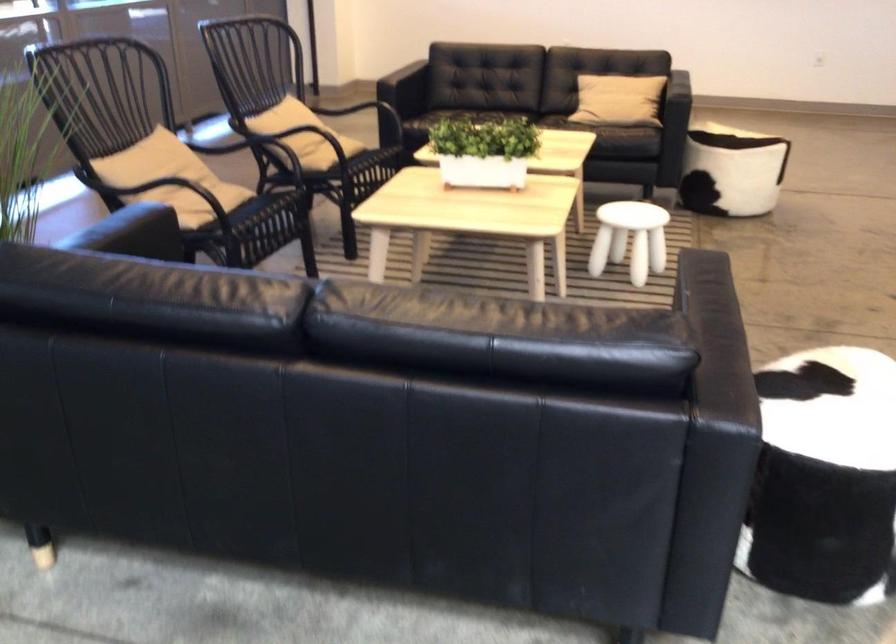
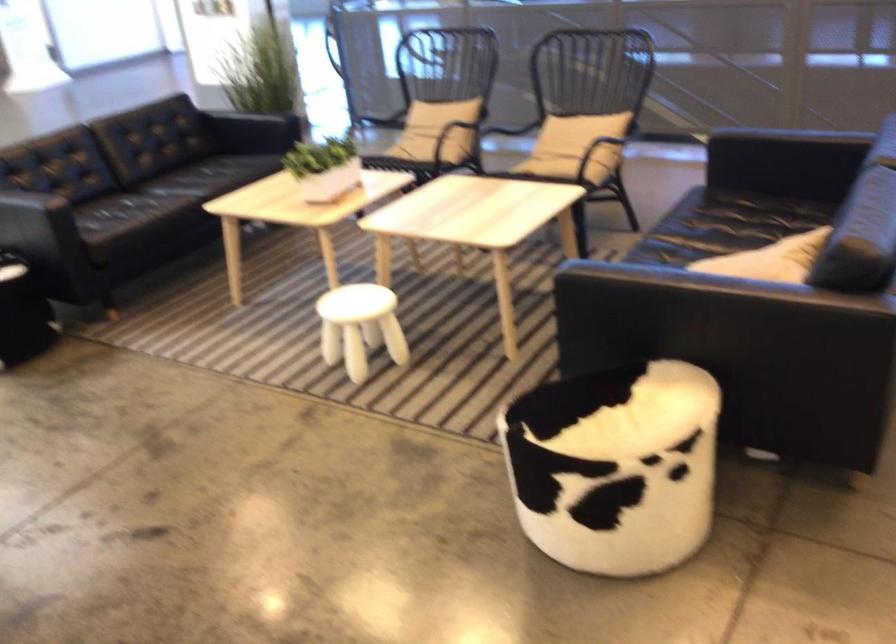
Find the pixel in the second image that matches pixel 214 176 in the first image.

(440, 128)